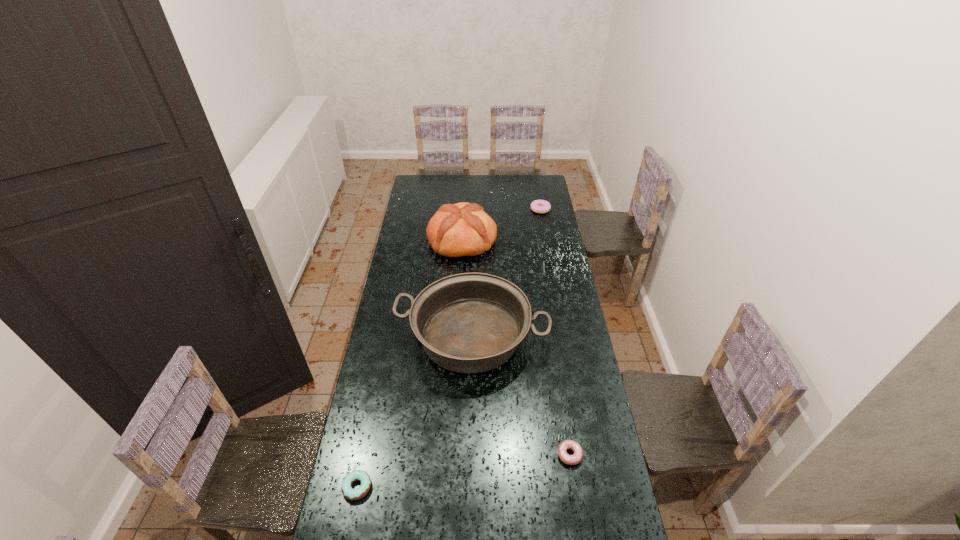
Identify the location of the tallest object. (463, 229).

Find the location of `bread`. bread is located at coordinates (463, 229).

Locate an element on the screen. pan is located at coordinates (470, 322).

Locate an element on the screen. The height and width of the screenshot is (540, 960). the third nearest object is located at coordinates (470, 322).

This screenshot has height=540, width=960. In order to click on the farthest doughnut in this screenshot , I will do `click(538, 206)`.

Identify the location of the tallest doughnut. (538, 206).

The height and width of the screenshot is (540, 960). Find the location of `the second farthest doughnut`. the second farthest doughnut is located at coordinates (574, 459).

The image size is (960, 540). I want to click on the leftmost doughnut, so [352, 494].

What are the coordinates of `the nearest doughnut` in the screenshot? It's located at (352, 494).

Identify the location of free space located on the back of the second farthest object. (464, 208).